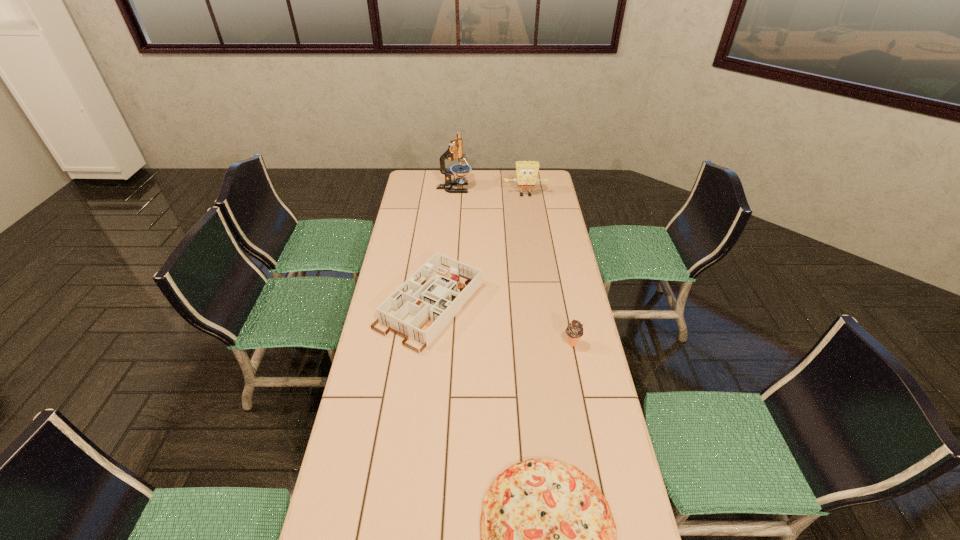
This screenshot has width=960, height=540. What are the coordinates of `free space that satisfies the following two spatial constraints: 1. at the eyepiece of the tallest object; 2. on the back side of the third tallest object` in the screenshot? It's located at (442, 343).

The height and width of the screenshot is (540, 960). Find the location of `free space that satisfies the following two spatial constraints: 1. on the back side of the icecream; 2. at the eyepiece of the tallest object`. free space that satisfies the following two spatial constraints: 1. on the back side of the icecream; 2. at the eyepiece of the tallest object is located at coordinates (541, 188).